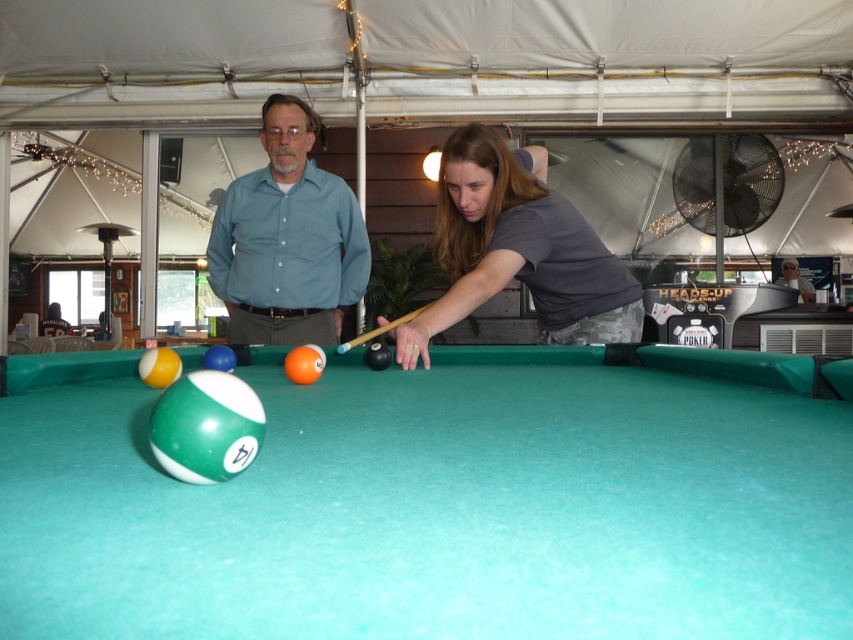
From the picture: You are standing at the position of the person in the light blue shirt at center and want to pick up the wooden cue at center. Can you reach it without moving your feet?

The light blue shirt at center is 5.05 meters away from the wooden cue at center. Since the average human arm length is about 0.7 meters, you cannot reach the wooden cue at center without moving your feet.

You are standing at the edge of the tent and want to walk to the light blue shirt at center without stepping on the green felt billiard table at center. Which direction should you move relative to the table?

The green felt billiard table at center is to the left of the light blue shirt at center. To reach the light blue shirt at center without stepping on the table, you should move to the right side of the table.